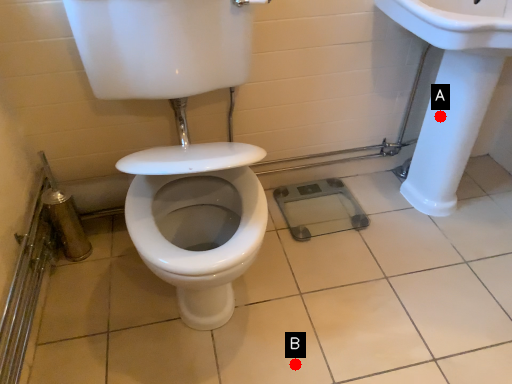
Question: Two points are circled on the image, labeled by A and B beside each circle. Which of the following is the farthest from the observer?

Choices:
 (A) A is further
 (B) B is further

Answer: (A)